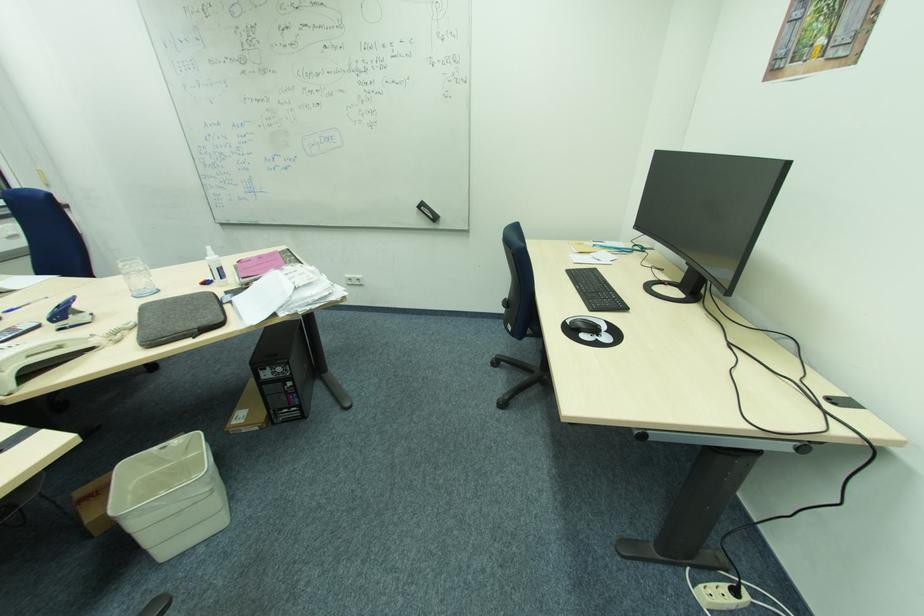
Image resolution: width=924 pixels, height=616 pixels. What do you see at coordinates (428, 211) in the screenshot? I see `a black whiteboard eraser` at bounding box center [428, 211].